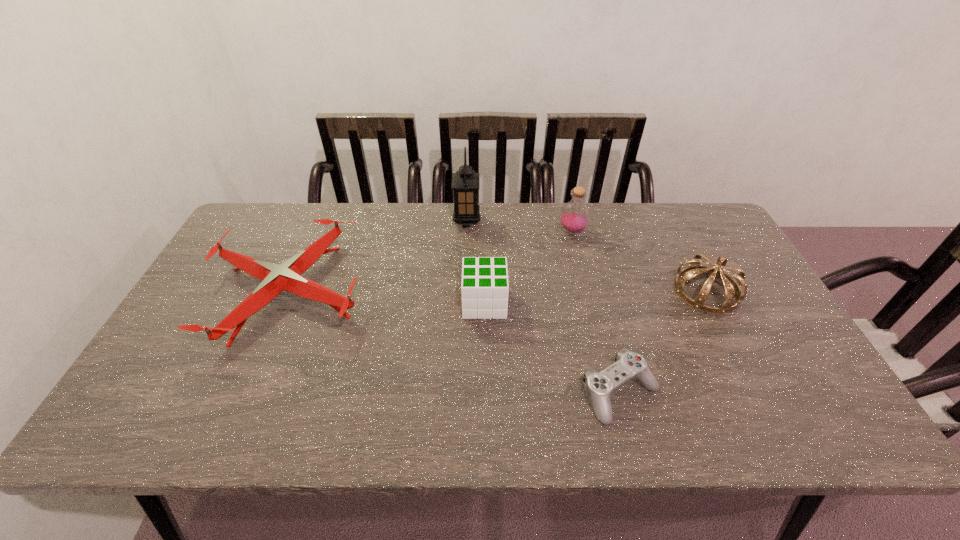
Image resolution: width=960 pixels, height=540 pixels. I want to click on blank region between the bottle and the nearest object, so (596, 312).

You are a GUI agent. You are given a task and a screenshot of the screen. Output one action in this format:
    pyautogui.click(x=<x>, y=<y>)
    Task: Click on the blank region between the cube and the tiara
    The width and height of the screenshot is (960, 540).
    Given the screenshot: What is the action you would take?
    pyautogui.click(x=595, y=297)

Where is `free spot between the fifth tallest object and the control`? free spot between the fifth tallest object and the control is located at coordinates (455, 342).

This screenshot has height=540, width=960. In order to click on free space between the tiara and the tallest object in this screenshot , I will do `click(587, 256)`.

Where is `free space between the leftmost object and the cube`? This screenshot has width=960, height=540. free space between the leftmost object and the cube is located at coordinates (387, 298).

I want to click on free space that is in between the second tallest object and the tiara, so click(639, 261).

Locate an element on the screen. This screenshot has height=540, width=960. vacant point located between the tallest object and the leftmost object is located at coordinates 378,256.

Image resolution: width=960 pixels, height=540 pixels. What are the coordinates of `free spot between the fifth shortest object and the lantern` in the screenshot? It's located at (519, 226).

Point out which object is positioned as the fourth nearest to the second shortest object. Please provide its 2D coordinates. Your answer should be formatted as a tuple, i.e. [(x, y)], where the tuple contains the x and y coordinates of a point satisfying the conditions above.

[(574, 217)]

Identify which object is the second nearest to the control. Please provide its 2D coordinates. Your answer should be formatted as a tuple, i.e. [(x, y)], where the tuple contains the x and y coordinates of a point satisfying the conditions above.

[(484, 288)]